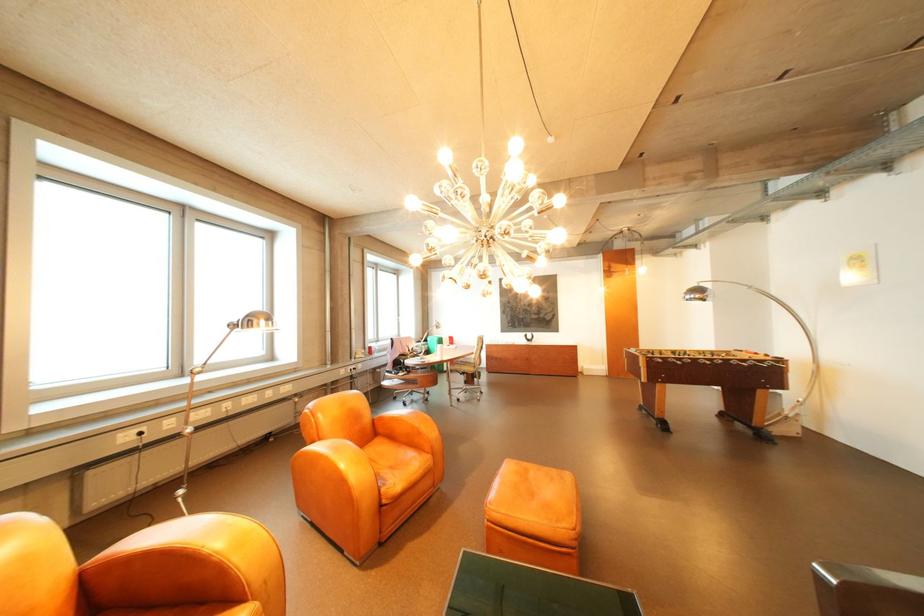
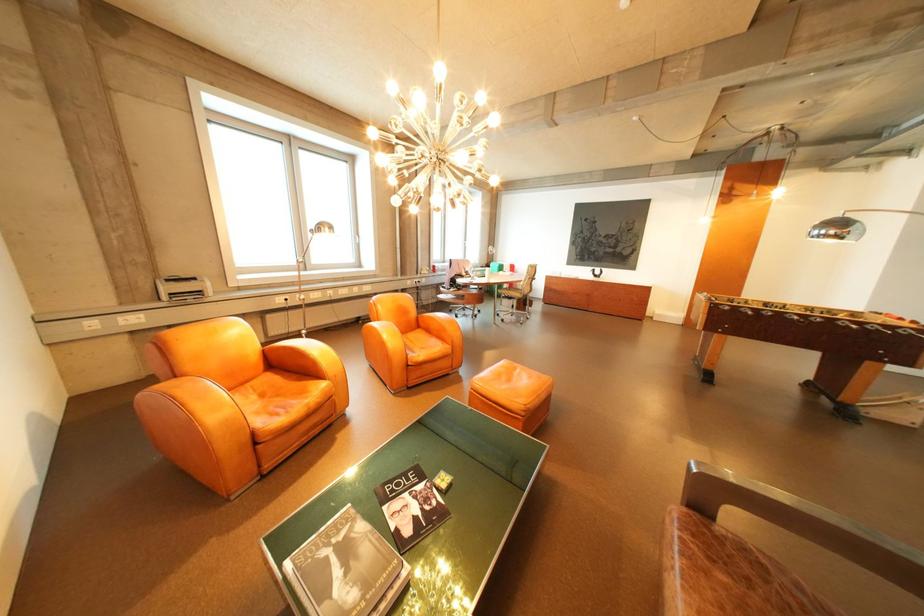
In the second image, find the point that corresponds to (x=540, y=471) in the first image.

(528, 370)